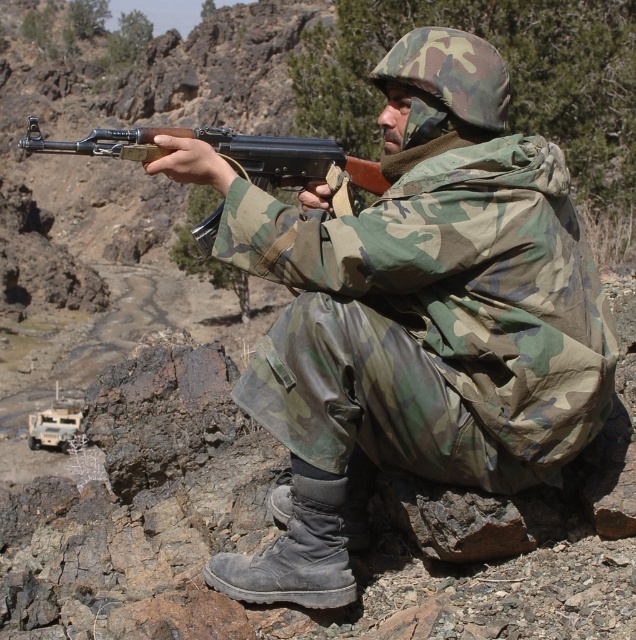
Consider the image. Can you confirm if camo fabric uniform at center is bigger than rough textured rock at center?

Actually, camo fabric uniform at center might be smaller than rough textured rock at center.

This screenshot has width=636, height=640. Describe the element at coordinates (411, 316) in the screenshot. I see `camo fabric uniform at center` at that location.

Where is `camo fabric uniform at center`? This screenshot has height=640, width=636. camo fabric uniform at center is located at coordinates (411, 316).

Who is taller, rough textured rock at center or matte black shotgun at center?

matte black shotgun at center

Does rough textured rock at center have a lesser width compared to matte black shotgun at center?

Yes.

Who is more distant from viewer, (633, 381) or (113, 138)?

Point (633, 381)

Find the location of a particular element. rough textured rock at center is located at coordinates (244, 516).

Is camo fabric uniform at center taller than matte black shotgun at center?

No.

Can you confirm if camo fabric uniform at center is bigger than matte black shotgun at center?

Incorrect, camo fabric uniform at center is not larger than matte black shotgun at center.

Which is behind, point (439, 196) or point (209, 230)?

Point (209, 230)

Locate an element on the screen. camo fabric uniform at center is located at coordinates (411, 316).